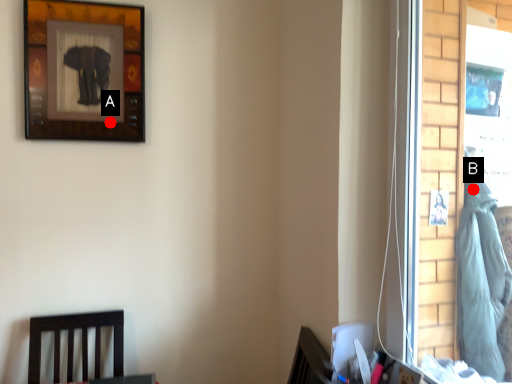
Question: Two points are circled on the image, labeled by A and B beside each circle. Among these points, which one is farthest from the camera?

Choices:
 (A) A is further
 (B) B is further

Answer: (A)